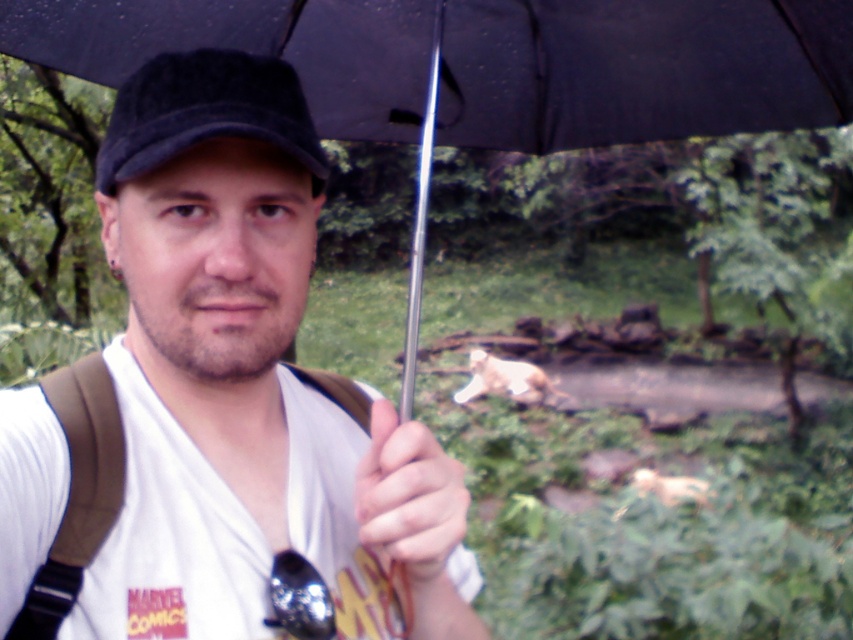
Question: Which object appears closest to the camera in this image?

Choices:
 (A) black fuzzy baseball cap at center
 (B) white matte t-shirt at center

Answer: (B)

Question: Is white matte t-shirt at center behind black matte umbrella at upper center?

Choices:
 (A) yes
 (B) no

Answer: (B)

Question: Which of the following is the farthest from the observer?

Choices:
 (A) smooth skin hand at center
 (B) white matte t-shirt at center
 (C) black fuzzy baseball cap at center
 (D) black matte umbrella at upper center

Answer: (D)

Question: Is white matte t-shirt at center positioned at the back of black fuzzy baseball cap at center?

Choices:
 (A) no
 (B) yes

Answer: (A)

Question: Is white matte t-shirt at center in front of smooth skin hand at center?

Choices:
 (A) no
 (B) yes

Answer: (B)

Question: Which of the following is the closest to the observer?

Choices:
 (A) white matte t-shirt at center
 (B) smooth skin hand at center
 (C) black fuzzy baseball cap at center

Answer: (A)